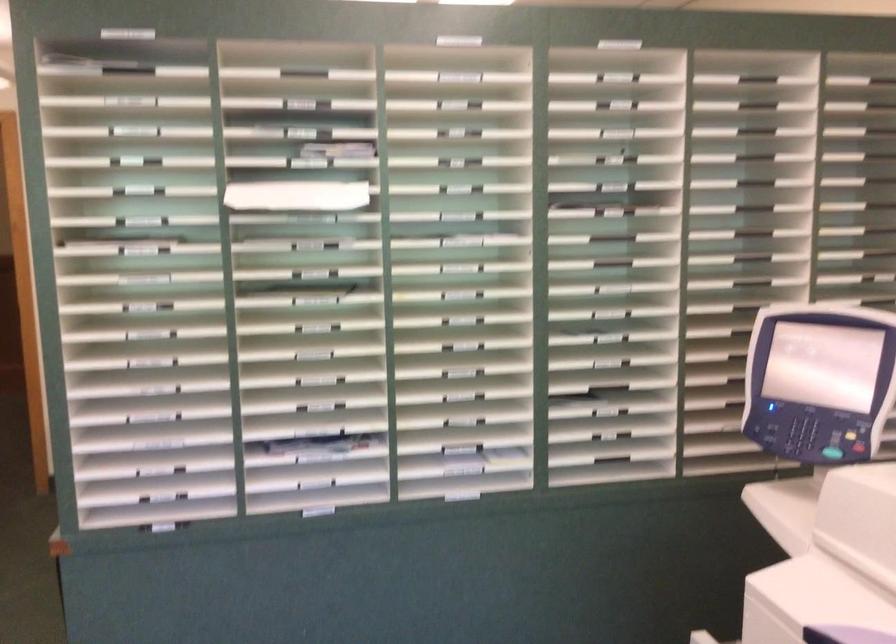
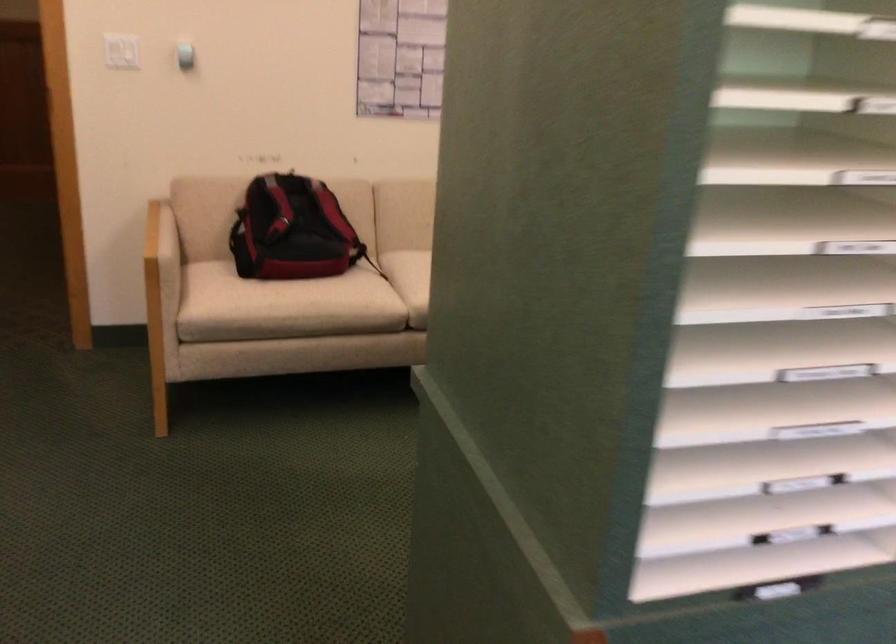
Which direction would the cameraman need to move to produce the second image?

The movement direction of the cameraman is left, forward.